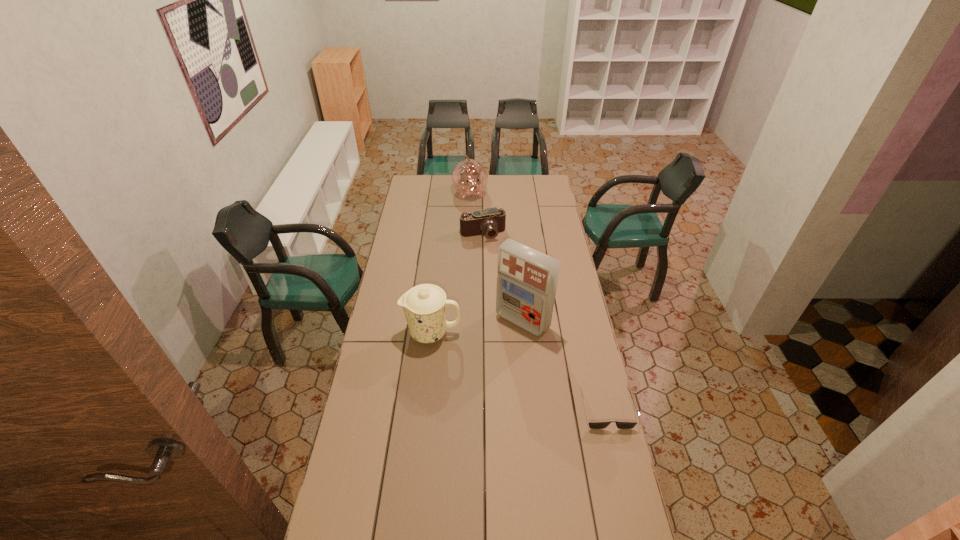
The height and width of the screenshot is (540, 960). Identify the location of chinaware. (424, 305).

Identify the location of the nearest object. Image resolution: width=960 pixels, height=540 pixels. (592, 425).

Where is `the rightmost object`? the rightmost object is located at coordinates (592, 425).

Find the location of `piggy bank`. piggy bank is located at coordinates (469, 177).

This screenshot has height=540, width=960. Find the location of `the first-aid kit`. the first-aid kit is located at coordinates (527, 279).

At what (x,y) coordinates should I click in order to perform the action: click on camera. Please return your answer as a coordinate pair (x, y). The image size is (960, 540). Looking at the image, I should click on (491, 221).

What are the coordinates of `the fourth tallest object` in the screenshot? It's located at (491, 221).

Where is `vacant space located on the front-facing side of the rightmost object`? The height and width of the screenshot is (540, 960). vacant space located on the front-facing side of the rightmost object is located at coordinates (624, 484).

At what (x,y) coordinates should I click in order to perform the action: click on vacant space located 0.340m on the front facing side of the piggy bank. Please return your answer as a coordinate pair (x, y). The height and width of the screenshot is (540, 960). Looking at the image, I should click on (486, 239).

The width and height of the screenshot is (960, 540). Find the location of `vacant space located on the front facing side of the piggy bank`. vacant space located on the front facing side of the piggy bank is located at coordinates (480, 223).